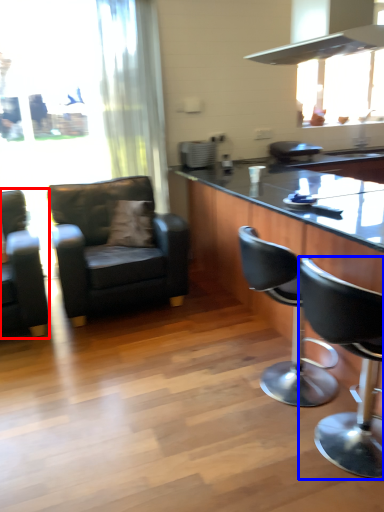
Question: Which of the following is the closest to the observer, chair (highlighted by a red box) or chair (highlighted by a blue box)?

Choices:
 (A) chair
 (B) chair

Answer: (B)